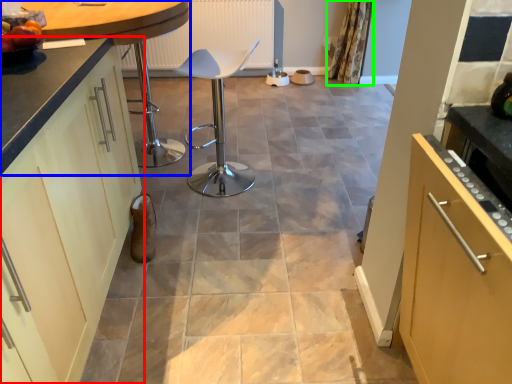
Question: Which object is positioned farthest from cabinetry (highlighted by a red box)? Select from countertop (highlighted by a blue box) and curtain (highlighted by a green box).

Choices:
 (A) countertop
 (B) curtain

Answer: (B)